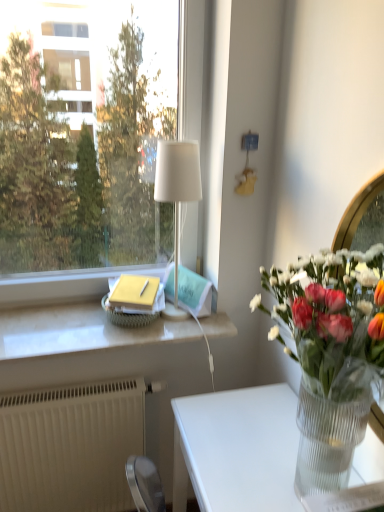
Question: From the image's perspective, is clear glass vase at right over white textured radiator at lower left?

Choices:
 (A) yes
 (B) no

Answer: (A)

Question: Is clear glass vase at right wider than white textured radiator at lower left?

Choices:
 (A) no
 (B) yes

Answer: (B)

Question: Considering the relative sizes of clear glass vase at right and white textured radiator at lower left in the image provided, is clear glass vase at right bigger than white textured radiator at lower left?

Choices:
 (A) yes
 (B) no

Answer: (A)

Question: From a real-world perspective, is clear glass vase at right on white textured radiator at lower left?

Choices:
 (A) no
 (B) yes

Answer: (B)

Question: Is clear glass vase at right facing towards white textured radiator at lower left?

Choices:
 (A) yes
 (B) no

Answer: (B)

Question: Does clear glass vase at right appear on the right side of white textured radiator at lower left?

Choices:
 (A) yes
 (B) no

Answer: (A)

Question: From a real-world perspective, is clear glass vase at right positioned under transparent glass window at upper left based on gravity?

Choices:
 (A) yes
 (B) no

Answer: (A)

Question: Does clear glass vase at right turn towards transparent glass window at upper left?

Choices:
 (A) no
 (B) yes

Answer: (A)

Question: Is clear glass vase at right thinner than transparent glass window at upper left?

Choices:
 (A) yes
 (B) no

Answer: (B)

Question: Does clear glass vase at right appear on the left side of transparent glass window at upper left?

Choices:
 (A) no
 (B) yes

Answer: (A)

Question: From the image's perspective, would you say clear glass vase at right is positioned over transparent glass window at upper left?

Choices:
 (A) no
 (B) yes

Answer: (A)

Question: Is clear glass vase at right not within transparent glass window at upper left?

Choices:
 (A) yes
 (B) no

Answer: (A)

Question: Can you confirm if transparent glass window at upper left is shorter than white textured radiator at lower left?

Choices:
 (A) yes
 (B) no

Answer: (B)